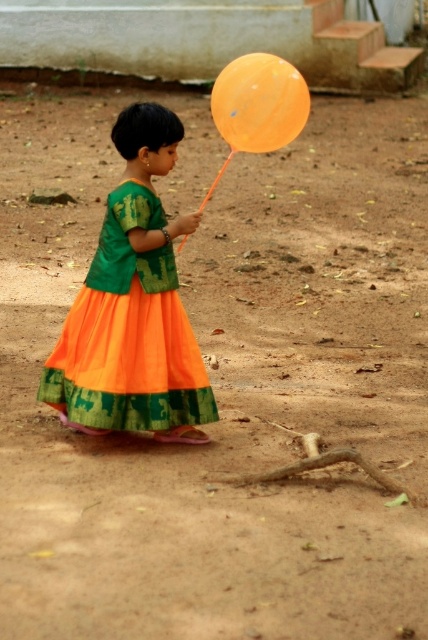
You are a photographer trying to capture the child in the image. The orange chiffon dress at center is your main focus. To ensure the dress is in the center of the photo, where should you position your camera relative to the child?

The orange chiffon dress at center is located at point (128, 333), which means it is slightly to the right and above the exact center of the image. To center the dress in the photo, you should adjust your camera position to the left and slightly downward to compensate for its offset.

You are standing at the point labeled point (x=89, y=364) and want to walk to the point labeled point (x=232, y=76). Which direction should you face to walk directly towards your destination?

You should face towards the upper left direction because point (x=232, y=76) is located to the upper left of point (x=89, y=364).